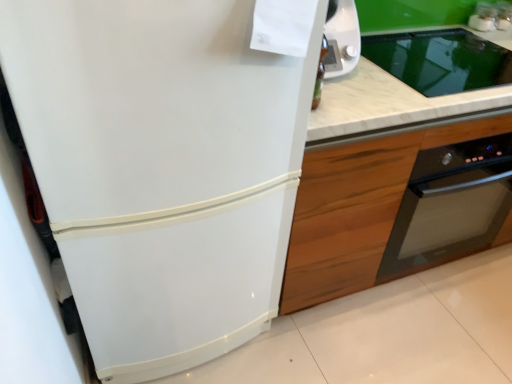
Question: From a real-world perspective, is white glossy refrigerator at left under wooden cabinet at right?

Choices:
 (A) no
 (B) yes

Answer: (A)

Question: Is wooden cabinet at right at the back of white glossy refrigerator at left?

Choices:
 (A) yes
 (B) no

Answer: (B)

Question: Does white glossy refrigerator at left appear on the left side of wooden cabinet at right?

Choices:
 (A) yes
 (B) no

Answer: (A)

Question: Is white glossy refrigerator at left not inside wooden cabinet at right?

Choices:
 (A) yes
 (B) no

Answer: (A)

Question: From the image's perspective, is white glossy refrigerator at left on top of wooden cabinet at right?

Choices:
 (A) yes
 (B) no

Answer: (B)

Question: Is white marble countertop at center to the left or to the right of white glossy refrigerator at left in the image?

Choices:
 (A) right
 (B) left

Answer: (A)

Question: Is white marble countertop at center in front of or behind white glossy refrigerator at left in the image?

Choices:
 (A) front
 (B) behind

Answer: (B)

Question: In terms of size, does white marble countertop at center appear bigger or smaller than white glossy refrigerator at left?

Choices:
 (A) small
 (B) big

Answer: (A)

Question: Looking at their shapes, would you say white marble countertop at center is wider or thinner than white glossy refrigerator at left?

Choices:
 (A) wide
 (B) thin

Answer: (B)

Question: From their relative heights in the image, would you say wooden cabinet at right is taller or shorter than white glossy refrigerator at left?

Choices:
 (A) tall
 (B) short

Answer: (B)

Question: Considering the relative positions of wooden cabinet at right and white glossy refrigerator at left in the image provided, is wooden cabinet at right to the left or to the right of white glossy refrigerator at left?

Choices:
 (A) right
 (B) left

Answer: (A)

Question: From a real-world perspective, is wooden cabinet at right positioned above or below white glossy refrigerator at left?

Choices:
 (A) above
 (B) below

Answer: (B)

Question: Would you say wooden cabinet at right is inside or outside white glossy refrigerator at left?

Choices:
 (A) inside
 (B) outside

Answer: (B)

Question: Is white glossy refrigerator at left in front of or behind wooden cabinet at right in the image?

Choices:
 (A) behind
 (B) front

Answer: (B)

Question: From the image's perspective, is white glossy refrigerator at left above or below wooden cabinet at right?

Choices:
 (A) below
 (B) above

Answer: (A)